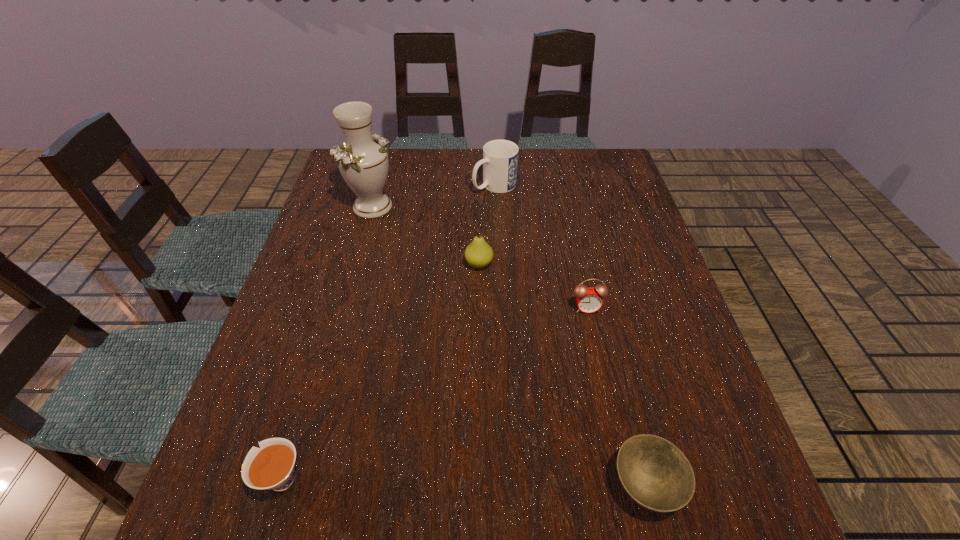
Where is `free space located 0.150m on the clock face of the alarm clock`? free space located 0.150m on the clock face of the alarm clock is located at coordinates (600, 370).

Find the location of a particular element. vacant space located 0.060m on the side of the teacup with the handle is located at coordinates (217, 479).

Locate an element on the screen. vacant space located 0.060m on the side of the teacup with the handle is located at coordinates (217, 479).

The width and height of the screenshot is (960, 540). Identify the location of free location located on the left of the bowl. (423, 485).

The height and width of the screenshot is (540, 960). I want to click on object present at the far edge, so click(500, 157).

I want to click on teacup that is at the near edge, so click(271, 467).

Find the location of a particular element. Image resolution: width=960 pixels, height=540 pixels. bowl at the near edge is located at coordinates (654, 472).

The image size is (960, 540). What are the coordinates of `vase situated at the left edge` in the screenshot? It's located at (363, 161).

This screenshot has width=960, height=540. What are the coordinates of `teacup situated at the left edge` in the screenshot? It's located at (271, 467).

Where is `object that is at the right edge`? Image resolution: width=960 pixels, height=540 pixels. object that is at the right edge is located at coordinates (654, 472).